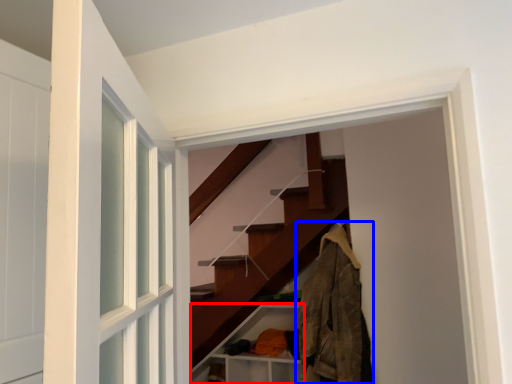
Question: Which object appears closest to the camera in this image, cabinet (highlighted by a red box) or clothing (highlighted by a blue box)?

Choices:
 (A) cabinet
 (B) clothing

Answer: (B)